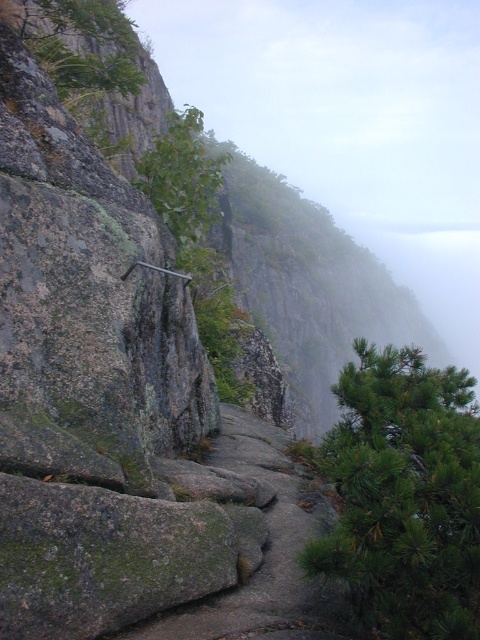
You are a hiker planning to take a photo of the green mossy rock at center and the green leafy tree at upper left. Which object will appear smaller in your photo?

The green mossy rock at center will appear smaller in the photo because it occupies less space than the green leafy tree at upper left.

You are a hiker trying to navigate the rocky trail. You notice the green mossy rock at center and the green leafy tree at upper left. Which object has a smaller width when viewed from above?

The green mossy rock at center is thinner than the green leafy tree at upper left, so the green mossy rock at center has a smaller width when viewed from above.